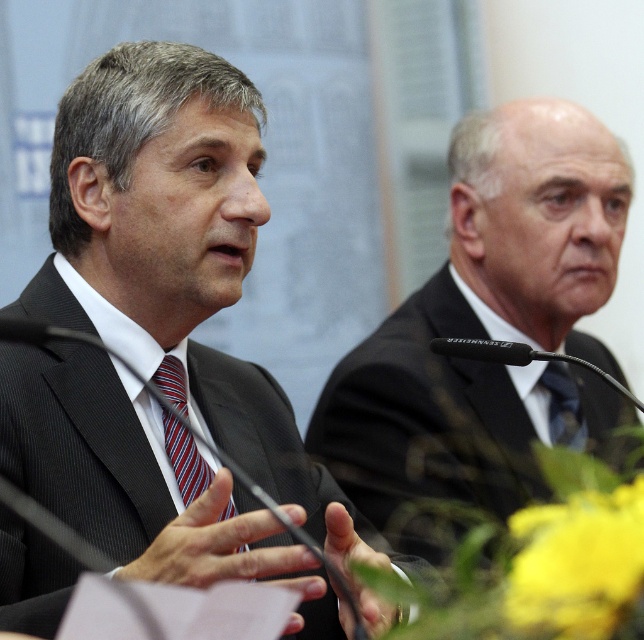
In the scene shown: Can you confirm if dark gray suit at left is shorter than striped fabric tie at center?

No, dark gray suit at left is not shorter than striped fabric tie at center.

Does dark gray suit at left come behind striped fabric tie at center?

No.

Locate an element on the screen. This screenshot has height=640, width=644. dark gray suit at left is located at coordinates (178, 257).

Image resolution: width=644 pixels, height=640 pixels. Identify the location of dark gray suit at left. (178, 257).

Can you confirm if dark gray suit at left is wider than matte blue tie at center?

Yes, dark gray suit at left is wider than matte blue tie at center.

Does dark gray suit at left appear on the right side of matte blue tie at center?

In fact, dark gray suit at left is to the left of matte blue tie at center.

This screenshot has width=644, height=640. I want to click on dark gray suit at left, so click(178, 257).

Does black suit at right have a smaller size compared to matte blue tie at center?

No, black suit at right is not smaller than matte blue tie at center.

Is black suit at right thinner than matte blue tie at center?

No, black suit at right is not thinner than matte blue tie at center.

At what (x,y) coordinates should I click in order to perform the action: click on black suit at right. Please return your answer as a coordinate pair (x, y). Looking at the image, I should click on (483, 323).

In order to click on black suit at right in this screenshot , I will do `click(483, 323)`.